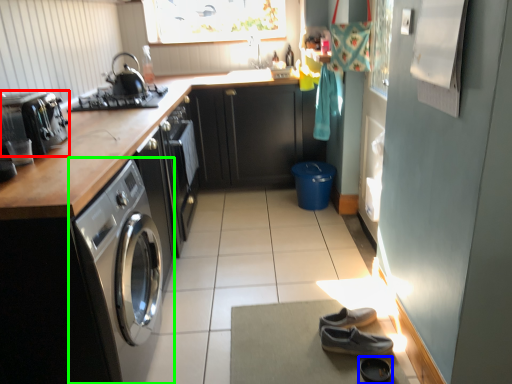
Question: Which object is positioned farthest from home appliance (highlighted by a red box)? Select from shoe (highlighted by a blue box) and washing machine (highlighted by a green box).

Choices:
 (A) shoe
 (B) washing machine

Answer: (A)